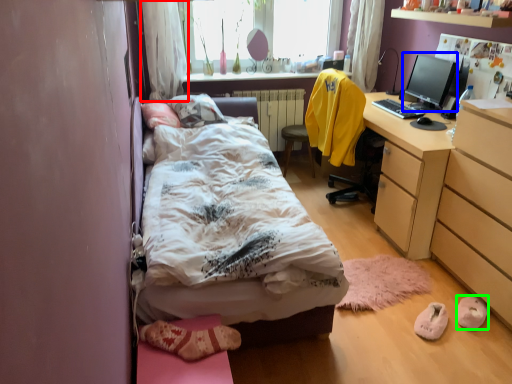
Question: Which is nearer to the curtain (highlighted by a red box)? computer monitor (highlighted by a blue box) or shoe (highlighted by a green box).

Choices:
 (A) computer monitor
 (B) shoe

Answer: (A)